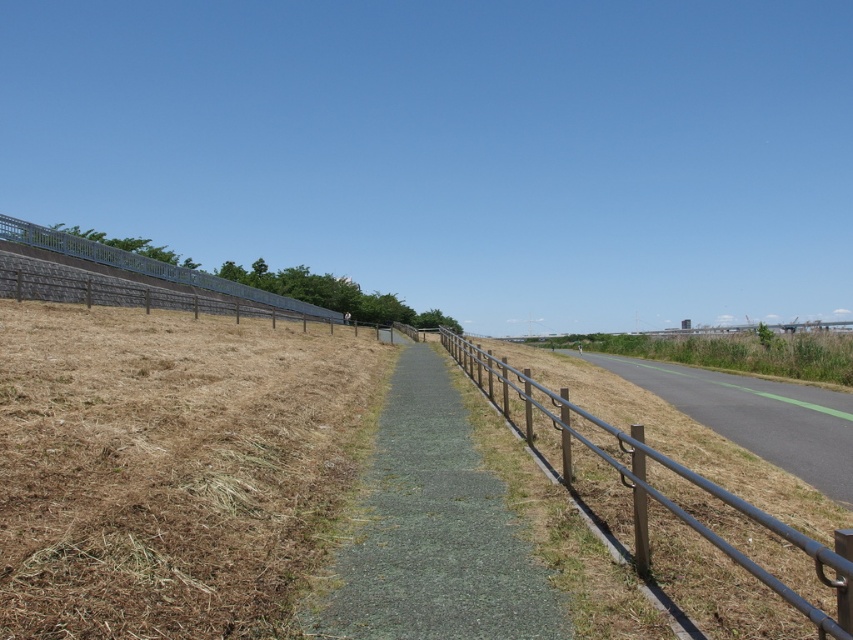
Does gray asphalt path at center have a lesser height compared to metallic gray fence at upper left?

Correct, gray asphalt path at center is not as tall as metallic gray fence at upper left.

Is point (419, 566) less distant than point (276, 301)?

Yes, it is in front of point (276, 301).

Locate an element on the screen. The image size is (853, 640). gray asphalt path at center is located at coordinates (434, 531).

Is brown dry grass at left smaller than metallic gray fence at upper left?

Yes, brown dry grass at left is smaller than metallic gray fence at upper left.

Is brown dry grass at left in front of metallic gray fence at upper left?

Yes, brown dry grass at left is closer to the viewer.

Is point (213, 611) behind point (273, 301)?

No, it is not.

This screenshot has width=853, height=640. I want to click on brown dry grass at left, so click(171, 468).

Between point (662, 504) and point (718, 392), which one is positioned in front?

Positioned in front is point (662, 504).

Consider the image. Does metallic gray fence at center appear on the right side of metallic gray path at right?

No, metallic gray fence at center is not to the right of metallic gray path at right.

Is point (611, 456) less distant than point (747, 401)?

Yes, it is in front of point (747, 401).

Locate an element on the screen. This screenshot has width=853, height=640. metallic gray fence at center is located at coordinates (671, 509).